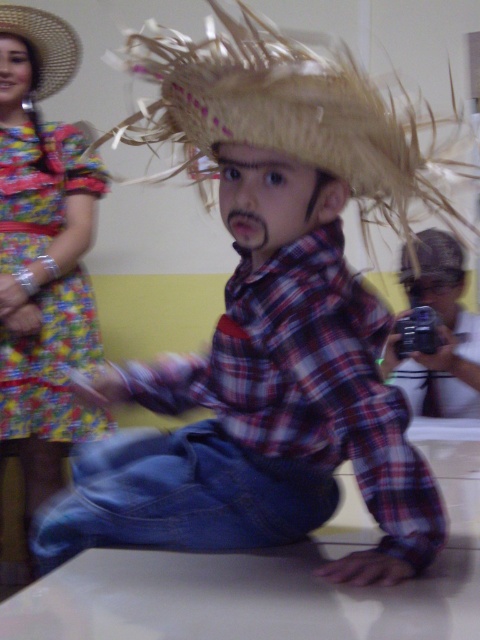
Can you confirm if straw at center is bigger than natural straw hat at upper left?

Correct, straw at center is larger in size than natural straw hat at upper left.

Is straw at center thinner than natural straw hat at upper left?

No.

Where is `straw at center`? The image size is (480, 640). straw at center is located at coordinates (279, 115).

Who is shorter, matte straw hat at center or natural straw hat at upper left?

natural straw hat at upper left is shorter.

Can you confirm if matte straw hat at center is wider than natural straw hat at upper left?

Yes, matte straw hat at center is wider than natural straw hat at upper left.

Identify the location of matte straw hat at center. The width and height of the screenshot is (480, 640). (441, 332).

The image size is (480, 640). What are the coordinates of `matte straw hat at center` in the screenshot? It's located at (441, 332).

Who is more forward, (x=147, y=115) or (x=50, y=198)?

Point (x=147, y=115)

Which is more to the right, straw at center or floral fabric dress at left?

straw at center is more to the right.

Describe the element at coordinates (279, 115) in the screenshot. This screenshot has height=640, width=480. I see `straw at center` at that location.

Identify the location of straw at center. The width and height of the screenshot is (480, 640). (279, 115).